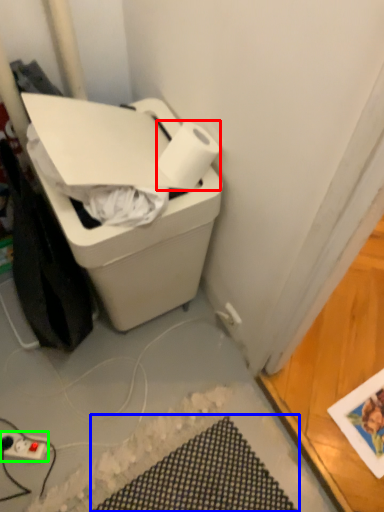
Question: Estimate the real-world distances between objects in this image. Which object is closer to paper towel (highlighted by a red box), bath mat (highlighted by a blue box) or power plugs and sockets (highlighted by a green box)?

Choices:
 (A) bath mat
 (B) power plugs and sockets

Answer: (A)